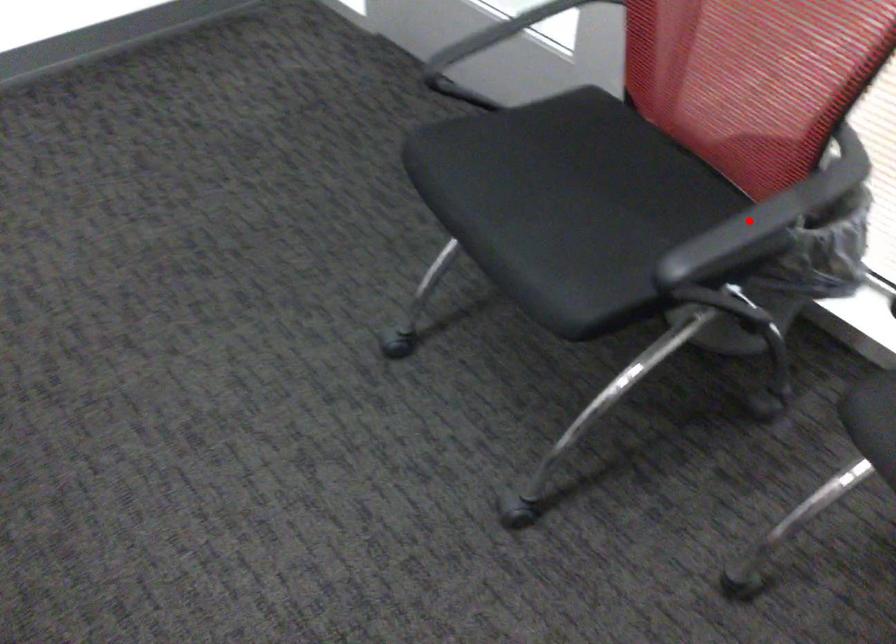
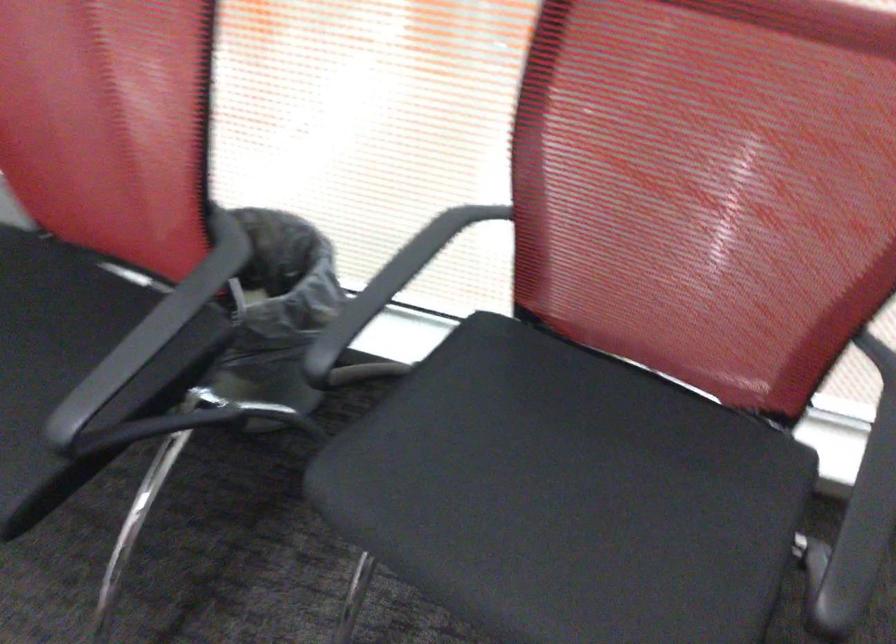
Where in the second image is the point corresponding to the highlighted location from the first image?

(140, 346)